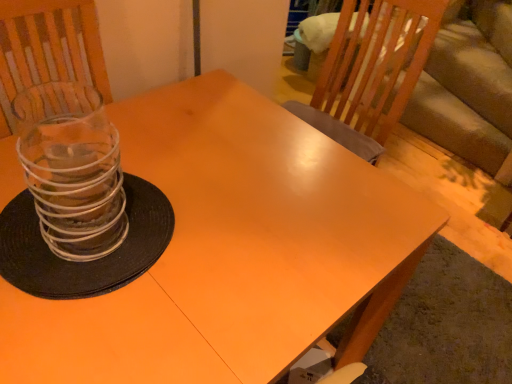
The image size is (512, 384). What do you see at coordinates (231, 250) in the screenshot?
I see `matte orange table at center` at bounding box center [231, 250].

The width and height of the screenshot is (512, 384). Identify the location of matte orange table at center. (231, 250).

Find the location of a particular element. This screenshot has height=384, width=512. clear glass candle holder at left is located at coordinates (72, 169).

What do you see at coordinates (72, 169) in the screenshot? This screenshot has height=384, width=512. I see `clear glass candle holder at left` at bounding box center [72, 169].

Measure the distance between point (79,168) and camera.

Point (79,168) and camera are 25.87 inches apart from each other.

You are a GUI agent. You are given a task and a screenshot of the screen. Output one action in this format:
    pyautogui.click(x=<x>, y=<y>)
    Task: Click on the matte orange table at center
    
    Given the screenshot: What is the action you would take?
    pyautogui.click(x=231, y=250)

Considering the relative positions of clear glass candle holder at left and matte orange table at center in the image provided, is clear glass candle holder at left to the left of matte orange table at center from the viewer's perspective?

Yes.

Who is more distant, clear glass candle holder at left or matte orange table at center?

clear glass candle holder at left is behind.

Which is in front, point (102, 169) or point (241, 281)?

The point (102, 169) is closer to the camera.

From the image's perspective, between clear glass candle holder at left and matte orange table at center, which one is located above?

From the image's view, clear glass candle holder at left is above.

From a real-world perspective, is clear glass candle holder at left above or below matte orange table at center?

Clearly, from a real-world perspective, clear glass candle holder at left is above matte orange table at center.

Between clear glass candle holder at left and matte orange table at center, which one has larger width?

matte orange table at center.

Considering the relative sizes of clear glass candle holder at left and matte orange table at center in the image provided, is clear glass candle holder at left shorter than matte orange table at center?

Correct, clear glass candle holder at left is not as tall as matte orange table at center.

Is clear glass candle holder at left smaller than matte orange table at center?

Correct, clear glass candle holder at left occupies less space than matte orange table at center.

Would you say matte orange table at center is part of clear glass candle holder at left's contents?

Actually, matte orange table at center is outside clear glass candle holder at left.

Can you see clear glass candle holder at left touching matte orange table at center?

No, clear glass candle holder at left is not making contact with matte orange table at center.

Is clear glass candle holder at left aimed at matte orange table at center?

No, clear glass candle holder at left is not aimed at matte orange table at center.

Can you tell me how much clear glass candle holder at left and matte orange table at center differ in facing direction?

clear glass candle holder at left and matte orange table at center are facing 0.886 degrees away from each other.

This screenshot has height=384, width=512. What are the coordinates of `table directly beneath the clear glass candle holder at left (from a real-world perspective)` in the screenshot? It's located at (231, 250).

Visually, is matte orange table at center positioned to the left or to the right of clear glass candle holder at left?

In the image, matte orange table at center appears on the right side of clear glass candle holder at left.

Is matte orange table at center behind clear glass candle holder at left?

That is False.

Which point is more distant from viewer, (225, 328) or (37, 87)?

The point (37, 87) is more distant.

From the image's perspective, which is above, matte orange table at center or clear glass candle holder at left?

From the image's view, clear glass candle holder at left is above.

From a real-world perspective, does matte orange table at center stand above clear glass candle holder at left?

No, from a real-world perspective, matte orange table at center is not over clear glass candle holder at left

Which of these two, matte orange table at center or clear glass candle holder at left, is wider?

Wider between the two is matte orange table at center.

Does matte orange table at center have a lesser height compared to clear glass candle holder at left?

Incorrect, the height of matte orange table at center does not fall short of that of clear glass candle holder at left.

Between matte orange table at center and clear glass candle holder at left, which one has smaller size?

With smaller size is clear glass candle holder at left.

Is matte orange table at center surrounding clear glass candle holder at left?

No, matte orange table at center does not contain clear glass candle holder at left.

Based on the photo, would you say matte orange table at center is a long distance from clear glass candle holder at left?

matte orange table at center is actually quite close to clear glass candle holder at left.

Is clear glass candle holder at left at the back of matte orange table at center?

matte orange table at center does not have its back to clear glass candle holder at left.

What's the angular difference between matte orange table at center and clear glass candle holder at left's facing directions?

There is a 0.886-degree angle between the facing directions of matte orange table at center and clear glass candle holder at left.

Measure the distance from matte orange table at center to clear glass candle holder at left.

A distance of 11.45 inches exists between matte orange table at center and clear glass candle holder at left.

In the image, there is a clear glass candle holder at left. Where is `table below it (from the image's perspective)`? This screenshot has width=512, height=384. table below it (from the image's perspective) is located at coordinates (231, 250).

Where is `table lying in front of the clear glass candle holder at left`? table lying in front of the clear glass candle holder at left is located at coordinates (231, 250).

You are a GUI agent. You are given a task and a screenshot of the screen. Output one action in this format:
    pyautogui.click(x=<x>, y=<y>)
    Task: Click on the candle holder on the left of the matte orange table at center
    The height and width of the screenshot is (384, 512).
    Given the screenshot: What is the action you would take?
    pyautogui.click(x=72, y=169)